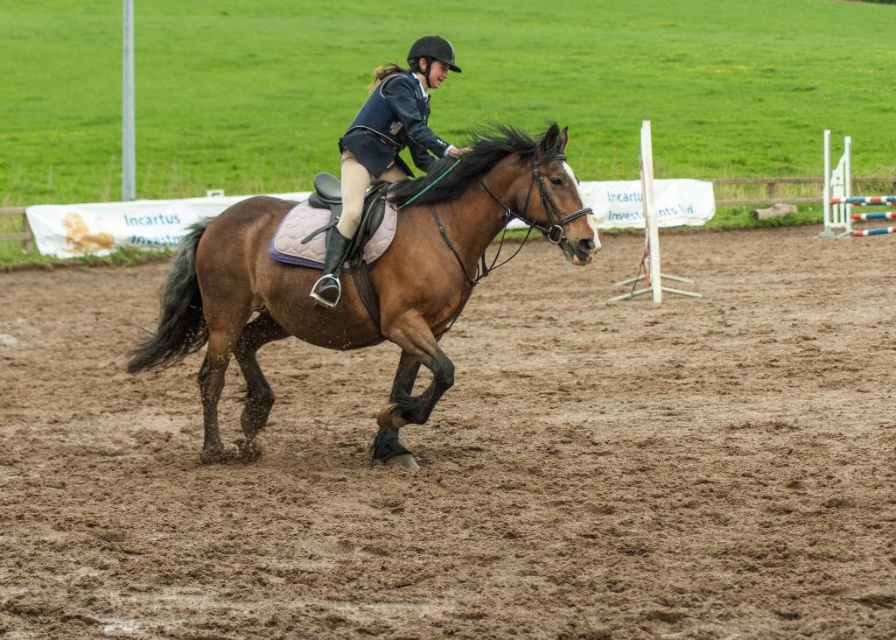
Question: Considering the relative positions of white plastic hurdle at upper right and white wooden hurdle at center right in the image provided, where is white plastic hurdle at upper right located with respect to white wooden hurdle at center right?

Choices:
 (A) left
 (B) right

Answer: (B)

Question: Which point is farther to the camera?

Choices:
 (A) (350, 221)
 (B) (825, 198)
 (C) (464, 272)

Answer: (B)

Question: Is brown sandy dirt at center to the left of matte black riding jacket at center from the viewer's perspective?

Choices:
 (A) no
 (B) yes

Answer: (A)

Question: Is brown glossy horse at center below white wooden hurdle at center right?

Choices:
 (A) yes
 (B) no

Answer: (A)

Question: Which object is the closest to the matte black riding jacket at center?

Choices:
 (A) brown glossy horse at center
 (B) brown sandy dirt at center
 (C) white wooden hurdle at center right
 (D) white plastic hurdle at upper right

Answer: (A)

Question: Which object is positioned closest to the matte black riding jacket at center?

Choices:
 (A) white plastic hurdle at upper right
 (B) brown sandy dirt at center

Answer: (B)